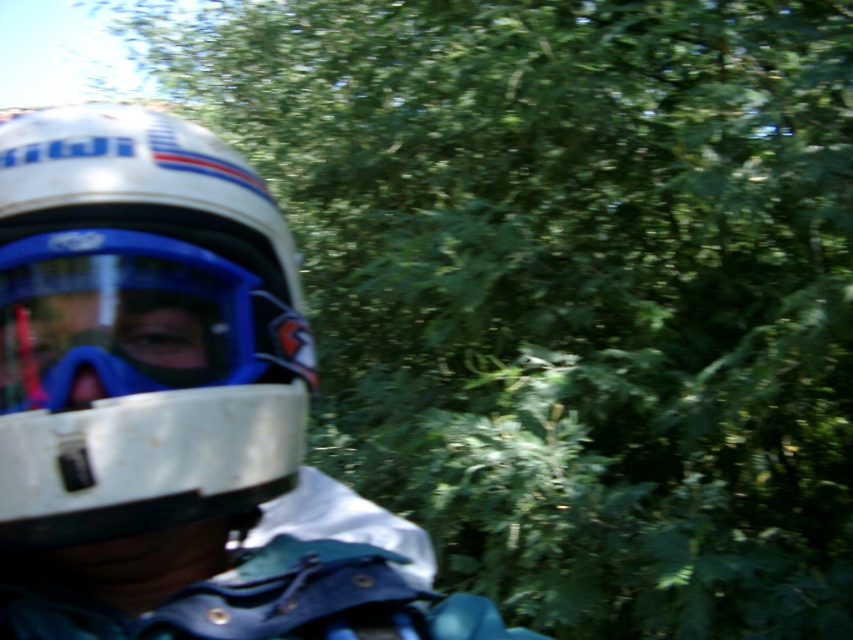
Question: Can you confirm if white matte helmet at left is bigger than blue matte/glossy goggles at left?

Choices:
 (A) no
 (B) yes

Answer: (B)

Question: Which point is closer to the camera?

Choices:
 (A) blue matte/glossy goggles at left
 (B) white matte helmet at left

Answer: (B)

Question: Is white matte helmet at left further to camera compared to blue matte/glossy goggles at left?

Choices:
 (A) yes
 (B) no

Answer: (B)

Question: Is white matte helmet at left behind blue matte/glossy goggles at left?

Choices:
 (A) no
 (B) yes

Answer: (A)